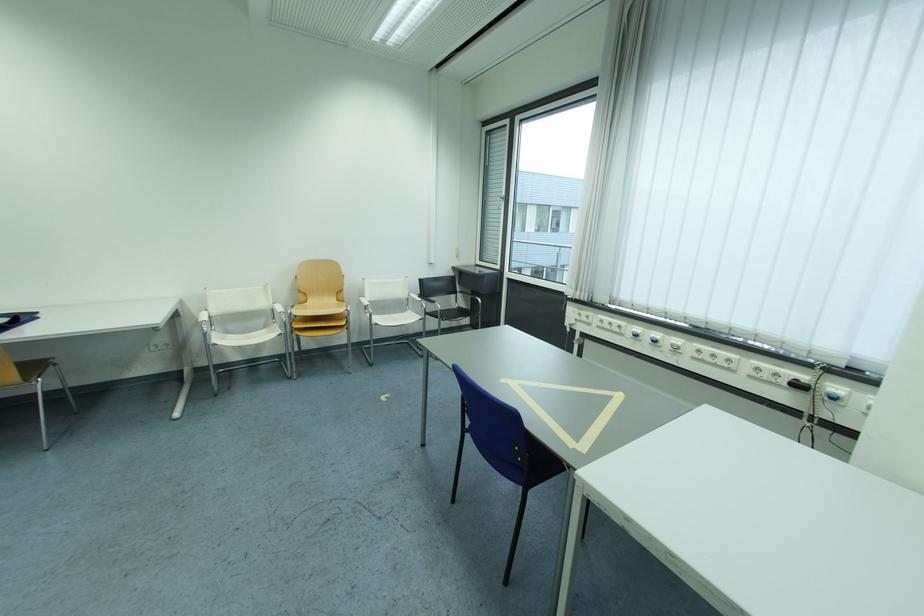
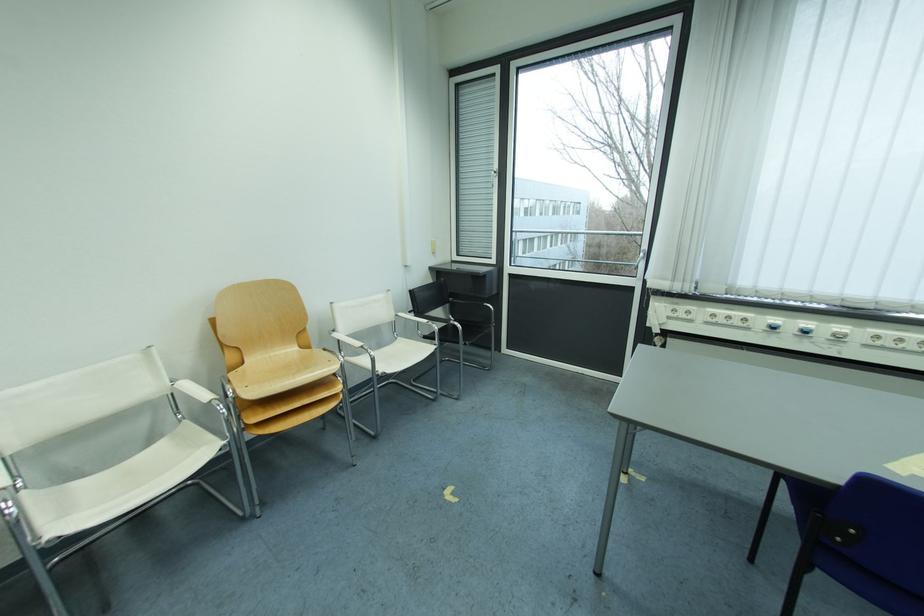
Where in the second image is the point corresponding to (x=701, y=360) from the first image?

(874, 347)